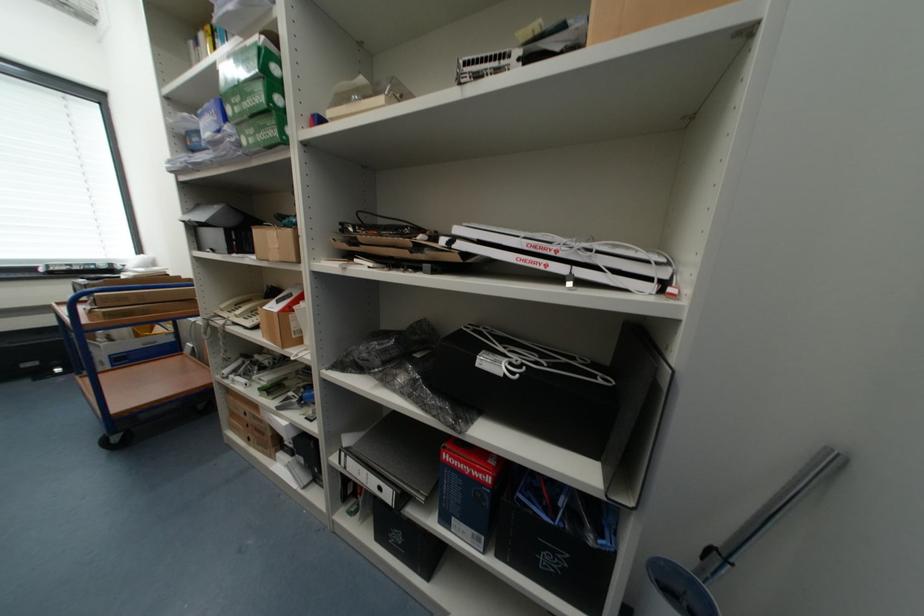
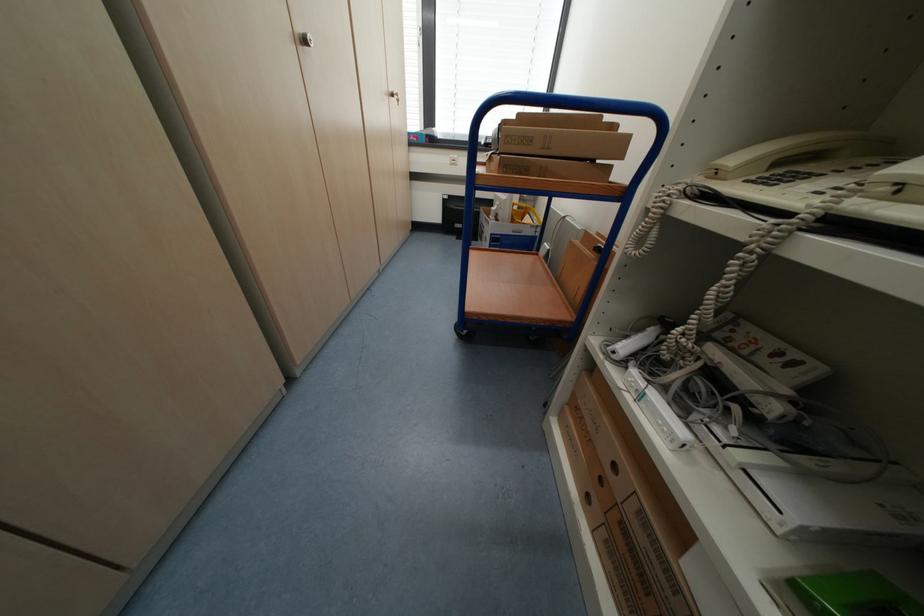
Where in the second image is the point corresponding to (x=91, y=323) from the first image?

(485, 171)